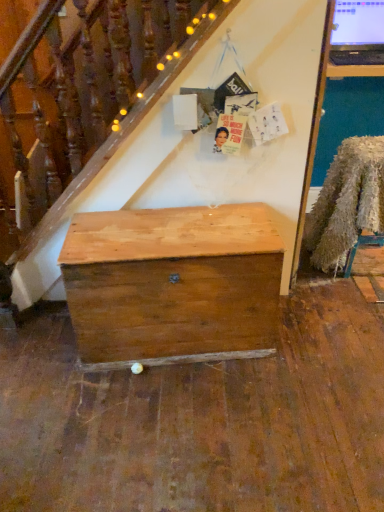
Question: Is natural wood chest at center further to camera compared to fuzzy fabric chair at right?

Choices:
 (A) no
 (B) yes

Answer: (A)

Question: Is natural wood chest at center not near fuzzy fabric chair at right?

Choices:
 (A) no
 (B) yes

Answer: (A)

Question: From a real-world perspective, is natural wood chest at center over fuzzy fabric chair at right?

Choices:
 (A) yes
 (B) no

Answer: (B)

Question: Does natural wood chest at center have a greater height compared to fuzzy fabric chair at right?

Choices:
 (A) no
 (B) yes

Answer: (A)

Question: Does natural wood chest at center appear on the right side of fuzzy fabric chair at right?

Choices:
 (A) no
 (B) yes

Answer: (A)

Question: Is natural wood chest at center thinner than fuzzy fabric chair at right?

Choices:
 (A) no
 (B) yes

Answer: (B)

Question: Is fuzzy fabric chair at right not close to natural wood chest at center?

Choices:
 (A) yes
 (B) no

Answer: (B)

Question: From a real-world perspective, does fuzzy fabric chair at right stand above natural wood chest at center?

Choices:
 (A) no
 (B) yes

Answer: (B)

Question: Is fuzzy fabric chair at right bigger than natural wood chest at center?

Choices:
 (A) no
 (B) yes

Answer: (A)

Question: Is fuzzy fabric chair at right taller than natural wood chest at center?

Choices:
 (A) yes
 (B) no

Answer: (A)

Question: Is fuzzy fabric chair at right at the left side of natural wood chest at center?

Choices:
 (A) yes
 (B) no

Answer: (B)

Question: Can you confirm if fuzzy fabric chair at right is shorter than natural wood chest at center?

Choices:
 (A) yes
 (B) no

Answer: (B)

Question: Choose the correct answer: Is fuzzy fabric chair at right inside natural wood chest at center or outside it?

Choices:
 (A) inside
 (B) outside

Answer: (B)